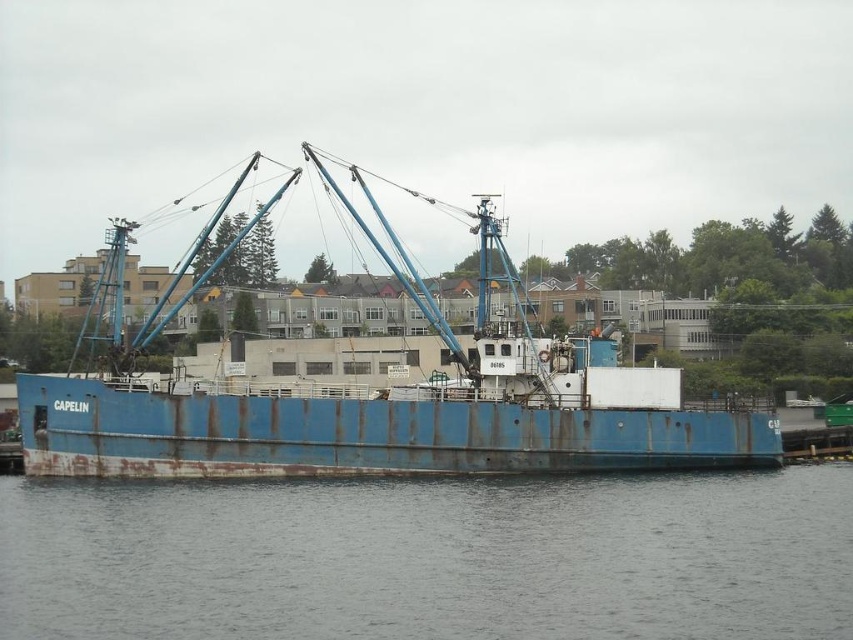
Which is more to the right, gray water at lower center or rusty metal boat at center?

From the viewer's perspective, gray water at lower center appears more on the right side.

Which is behind, point (822, 620) or point (115, 476)?

The point (115, 476) is behind.

Locate an element on the screen. gray water at lower center is located at coordinates (433, 557).